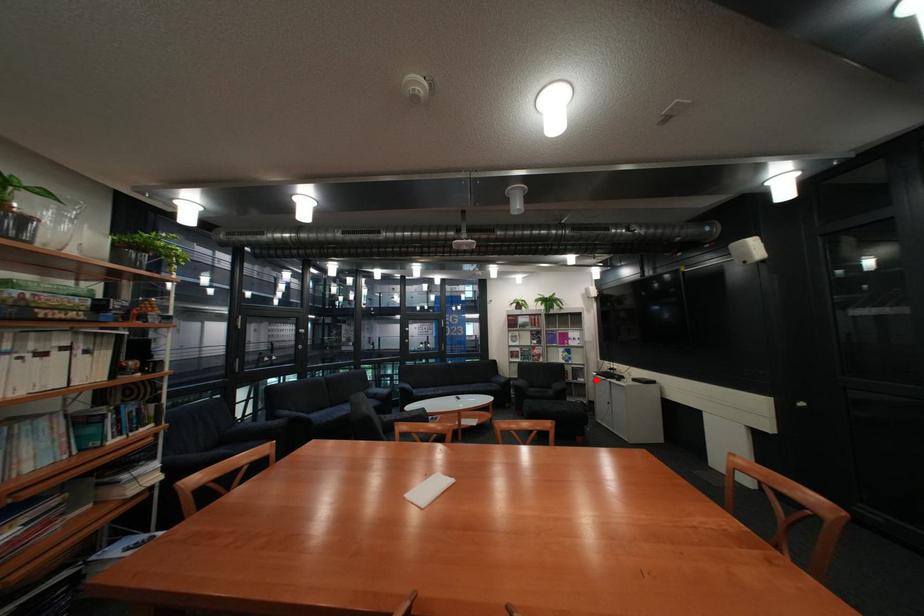
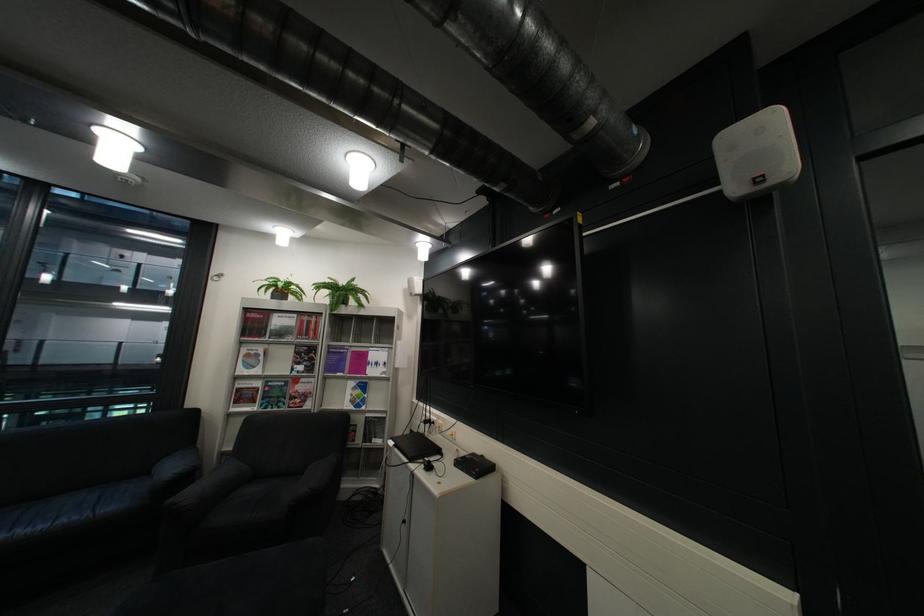
Where in the second image is the point corresponding to the highlighted location from the first image?

(393, 442)